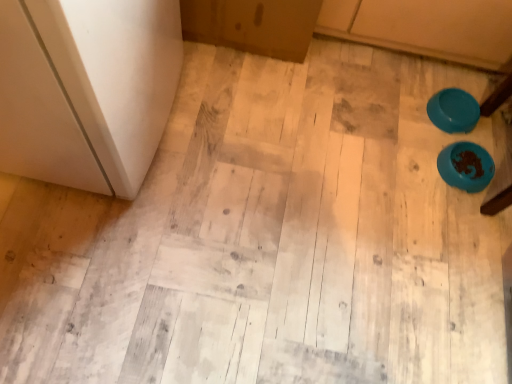
Question: From the image's perspective, is teal glossy bowl at upper right, which is the first bowl from top to bottom, on blue plastic bowl at lower right, which appears as the second bowl when viewed from the top?

Choices:
 (A) no
 (B) yes

Answer: (B)

Question: Is teal glossy bowl at upper right, which is the first bowl from top to bottom, at the left side of blue plastic bowl at lower right, which appears as the second bowl when viewed from the top?

Choices:
 (A) yes
 (B) no

Answer: (A)

Question: Is blue plastic bowl at lower right, which appears as the second bowl when viewed from the top, completely or partially inside teal glossy bowl at upper right, which is the first bowl from top to bottom?

Choices:
 (A) no
 (B) yes

Answer: (A)

Question: Is teal glossy bowl at upper right, which is the first bowl from top to bottom, facing away from blue plastic bowl at lower right, the first bowl positioned from the bottom?

Choices:
 (A) yes
 (B) no

Answer: (B)

Question: Does teal glossy bowl at upper right, which is the 2th bowl in bottom-to-top order, have a lesser height compared to blue plastic bowl at lower right, which appears as the second bowl when viewed from the top?

Choices:
 (A) yes
 (B) no

Answer: (A)

Question: Is the depth of teal glossy bowl at upper right, which is the 2th bowl in bottom-to-top order, greater than that of blue plastic bowl at lower right, which appears as the second bowl when viewed from the top?

Choices:
 (A) no
 (B) yes

Answer: (B)

Question: Is blue plastic bowl at lower right, the first bowl positioned from the bottom, far away from teal glossy bowl at upper right, which is the 2th bowl in bottom-to-top order?

Choices:
 (A) yes
 (B) no

Answer: (B)

Question: Does blue plastic bowl at lower right, the first bowl positioned from the bottom, have a lesser width compared to teal glossy bowl at upper right, which is the 2th bowl in bottom-to-top order?

Choices:
 (A) yes
 (B) no

Answer: (A)

Question: Is the depth of blue plastic bowl at lower right, the first bowl positioned from the bottom, greater than that of teal glossy bowl at upper right, which is the first bowl from top to bottom?

Choices:
 (A) yes
 (B) no

Answer: (B)

Question: From the image's perspective, is blue plastic bowl at lower right, the first bowl positioned from the bottom, over teal glossy bowl at upper right, which is the 2th bowl in bottom-to-top order?

Choices:
 (A) no
 (B) yes

Answer: (A)

Question: From a real-world perspective, is blue plastic bowl at lower right, the first bowl positioned from the bottom, positioned over teal glossy bowl at upper right, which is the first bowl from top to bottom, based on gravity?

Choices:
 (A) yes
 (B) no

Answer: (B)

Question: From a real-world perspective, does blue plastic bowl at lower right, which appears as the second bowl when viewed from the top, sit lower than teal glossy bowl at upper right, which is the first bowl from top to bottom?

Choices:
 (A) no
 (B) yes

Answer: (B)

Question: Considering the positions of teal glossy bowl at upper right, which is the first bowl from top to bottom, and blue plastic bowl at lower right, the first bowl positioned from the bottom, in the image, is teal glossy bowl at upper right, which is the first bowl from top to bottom, taller or shorter than blue plastic bowl at lower right, the first bowl positioned from the bottom,?

Choices:
 (A) short
 (B) tall

Answer: (A)